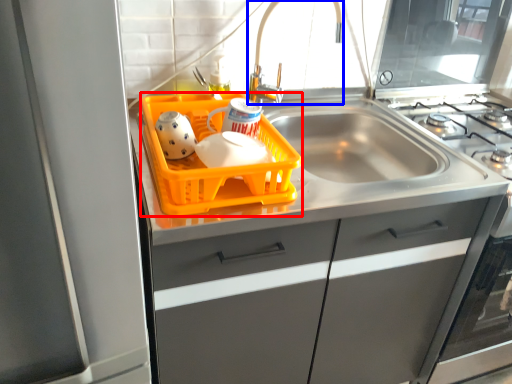
Question: Which object is further to the camera taking this photo, basket (highlighted by a red box) or faucet (highlighted by a blue box)?

Choices:
 (A) basket
 (B) faucet

Answer: (B)